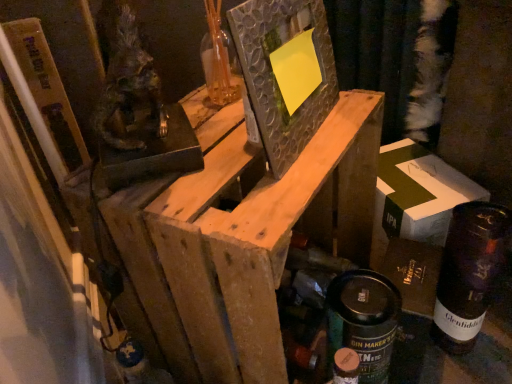
Question: Is matte black spray can at lower right positioned far away from textured glass picture frame at center?

Choices:
 (A) yes
 (B) no

Answer: (B)

Question: From a real-world perspective, does matte black spray can at lower right stand above textured glass picture frame at center?

Choices:
 (A) no
 (B) yes

Answer: (A)

Question: Does matte black spray can at lower right come in front of textured glass picture frame at center?

Choices:
 (A) yes
 (B) no

Answer: (B)

Question: Considering the relative sizes of matte black spray can at lower right and textured glass picture frame at center in the image provided, is matte black spray can at lower right wider than textured glass picture frame at center?

Choices:
 (A) yes
 (B) no

Answer: (A)

Question: Is matte black spray can at lower right positioned with its back to textured glass picture frame at center?

Choices:
 (A) yes
 (B) no

Answer: (B)

Question: Relative to wooden frame at center, is textured glass picture frame at center in front or behind?

Choices:
 (A) front
 (B) behind

Answer: (B)

Question: Is textured glass picture frame at center bigger or smaller than wooden frame at center?

Choices:
 (A) big
 (B) small

Answer: (B)

Question: Is textured glass picture frame at center taller or shorter than wooden frame at center?

Choices:
 (A) short
 (B) tall

Answer: (A)

Question: From the image's perspective, relative to wooden frame at center, is textured glass picture frame at center above or below?

Choices:
 (A) above
 (B) below

Answer: (A)

Question: Considering the positions of dark glass bottle at lower right and textured glass picture frame at center in the image, is dark glass bottle at lower right taller or shorter than textured glass picture frame at center?

Choices:
 (A) tall
 (B) short

Answer: (A)

Question: Based on their positions, is dark glass bottle at lower right located to the left or right of textured glass picture frame at center?

Choices:
 (A) left
 (B) right

Answer: (B)

Question: Looking at the image, does dark glass bottle at lower right seem bigger or smaller compared to textured glass picture frame at center?

Choices:
 (A) big
 (B) small

Answer: (A)

Question: In terms of width, does dark glass bottle at lower right look wider or thinner when compared to textured glass picture frame at center?

Choices:
 (A) wide
 (B) thin

Answer: (A)

Question: From a real-world perspective, is white cardboard box at right positioned above or below dark glass bottle at lower right?

Choices:
 (A) below
 (B) above

Answer: (A)

Question: Considering the positions of point (417, 193) and point (442, 349), is point (417, 193) closer or farther from the camera than point (442, 349)?

Choices:
 (A) closer
 (B) farther

Answer: (A)